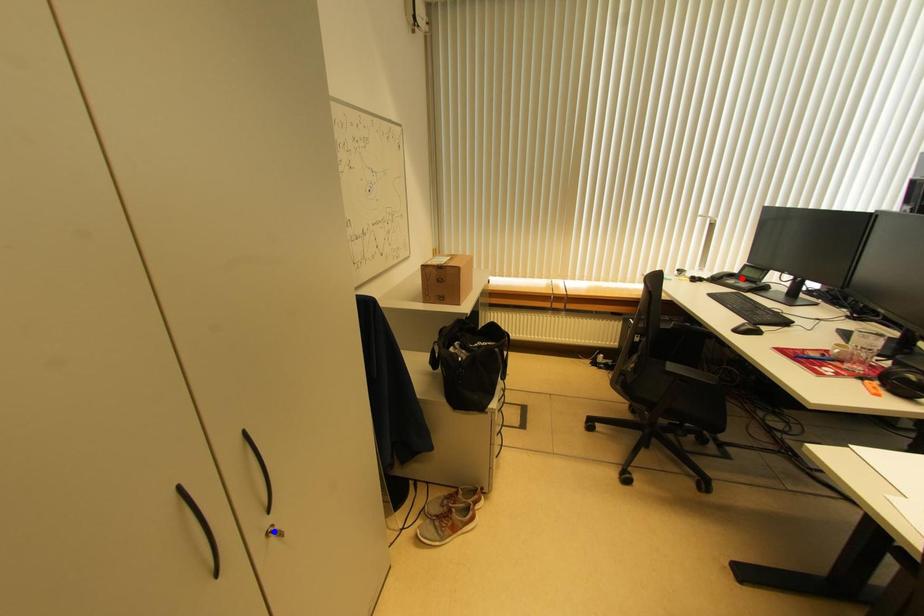
Question: Two points are marked on the image. Which point is closer to the camera?

Choices:
 (A) Blue point is closer.
 (B) Red point is closer.

Answer: (A)